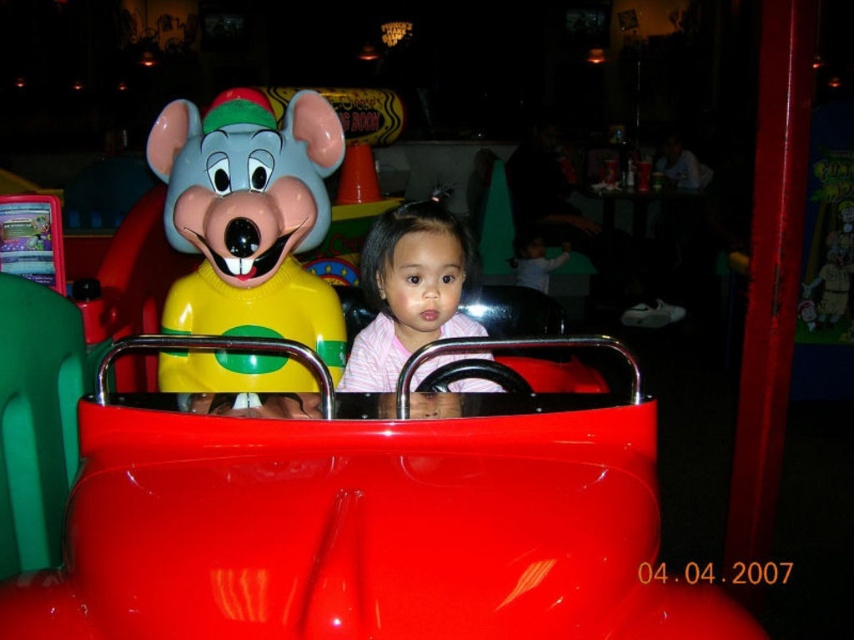
Based on the photo, you are a parent at the fairground. Your child is sitting in the glossy plastic toy car at center and wants to see the plastic mouse at left. Can they see it from their current position?

The glossy plastic toy car at center is in front of the plastic mouse at left, so the child sitting in the glossy plastic toy car at center would have the plastic mouse at left positioned behind them, making it difficult to see without turning around.

You are a parent standing next to your child who is sitting in the glossy plastic toy car at center. You want to hand them a juice box. Can you reach them without moving closer? The average adult arm length is about 25 inches.

The distance between the glossy plastic toy car at center and the camera is 37.62 inches. Since the average adult arm length is 25 inches, the parent cannot reach the child without moving closer.

Looking at this image, you are a visitor at the fairground and want to take a photo of the child in the bumper car. The plastic mouse at left and the pink striped shirt at center are both in your view. Which object should you focus on first to ensure the child is in focus?

The plastic mouse at left should be focused on first because the pink striped shirt at center is behind it, meaning the mouse is closer to you. Focusing on the closer object ensures the child in the bumper car will be in focus.